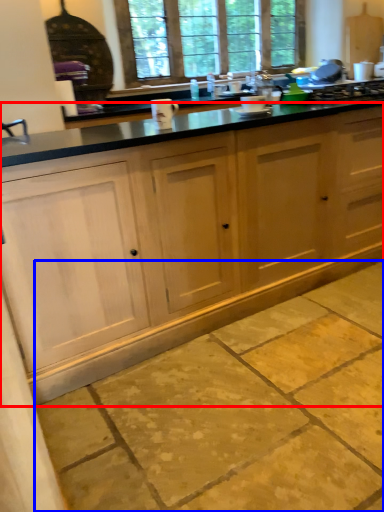
Question: Among these objects, which one is nearest to the camera, cabinetry (highlighted by a red box) or concrete (highlighted by a blue box)?

Choices:
 (A) cabinetry
 (B) concrete

Answer: (B)